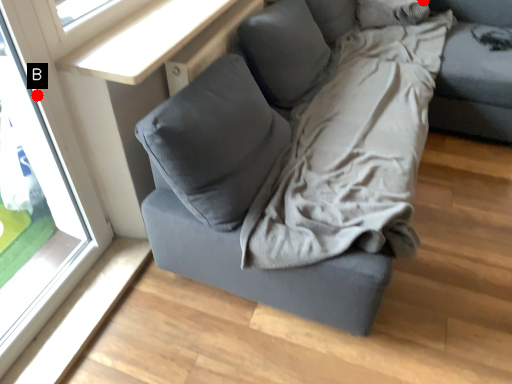
Question: Two points are circled on the image, labeled by A and B beside each circle. Among these points, which one is nearest to the camera?

Choices:
 (A) A is closer
 (B) B is closer

Answer: (B)